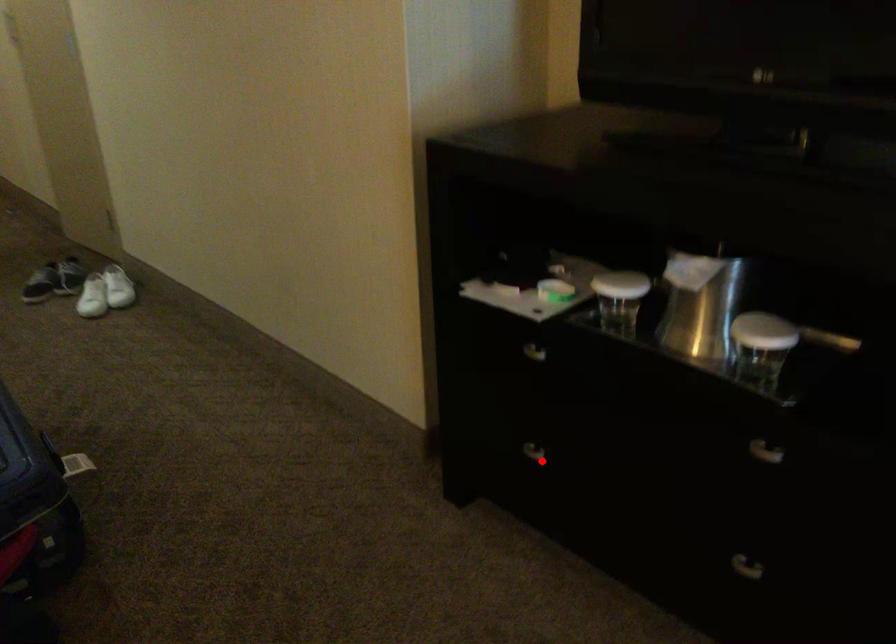
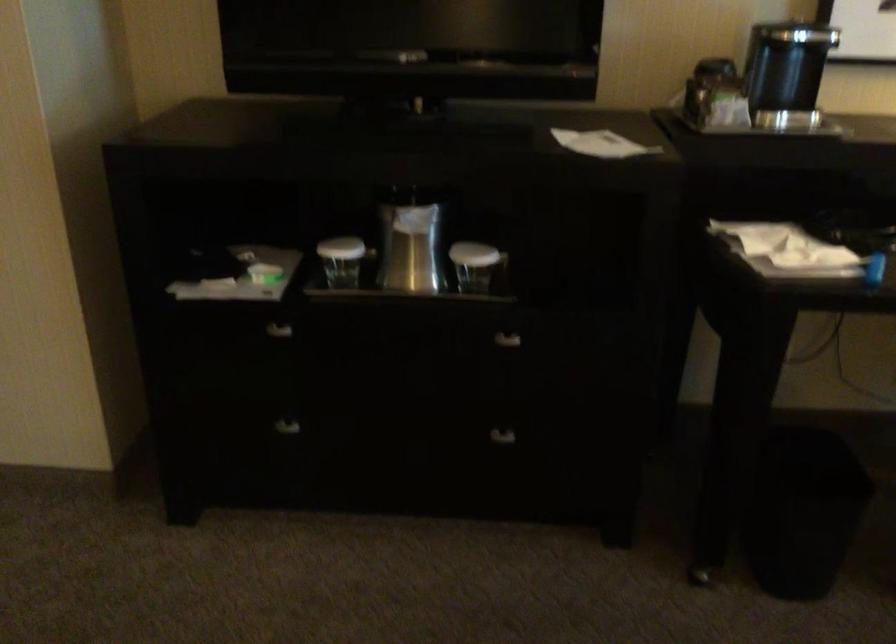
Find the pixel in the second image that matches the highlighted location in the first image.

(283, 435)